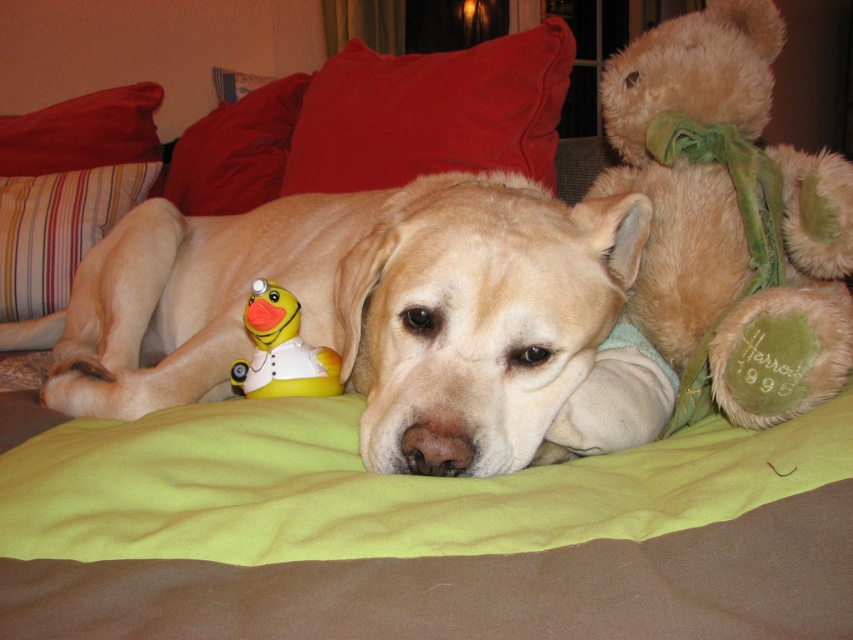
You are a dog owner who wants to ensure your golden fur dog at center is comfortable. Since the red cotton pillow at upper left is covering part of its body, should you move the pillow to give the dog more space?

The golden fur dog at center is positioned under the red cotton pillow at upper left, so moving the pillow might provide the dog with more space to stretch out comfortably.

You are a dog owner who wants to place a new toy between the velvety red pillow at upper left and the yellow rubber duck at center. Based on their positions, where should you place the new toy to ensure it is between them?

The velvety red pillow at upper left is above the yellow rubber duck at center, so placing the new toy between them would require positioning it below the pillow and above the duck.

You are a dog owner who wants to place a new toy for your golden fur dog at center. The toy you have is 10 cm tall. Considering the size of the red cotton pillow at upper left, can the toy be placed on top of the pillow without falling over?

The golden fur dog at center is taller than the red cotton pillow at upper left. Since the dog is taller, the pillow might not provide a stable base for the toy. The toy could potentially fall off if placed on the pillow due to the pillow being smaller in height compared to the dog.